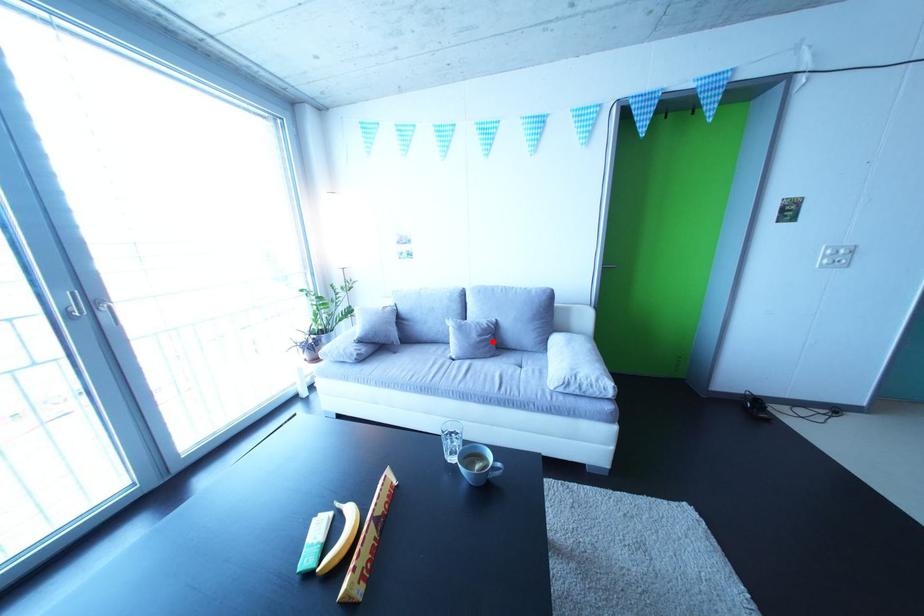
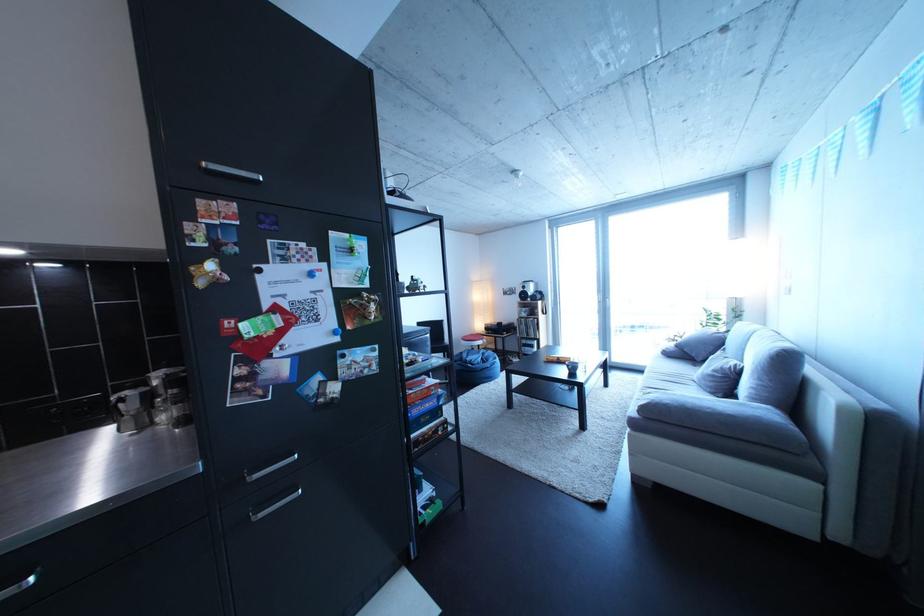
The point at the highlighted location is marked in the first image. Where is the corresponding point in the second image?

(727, 377)